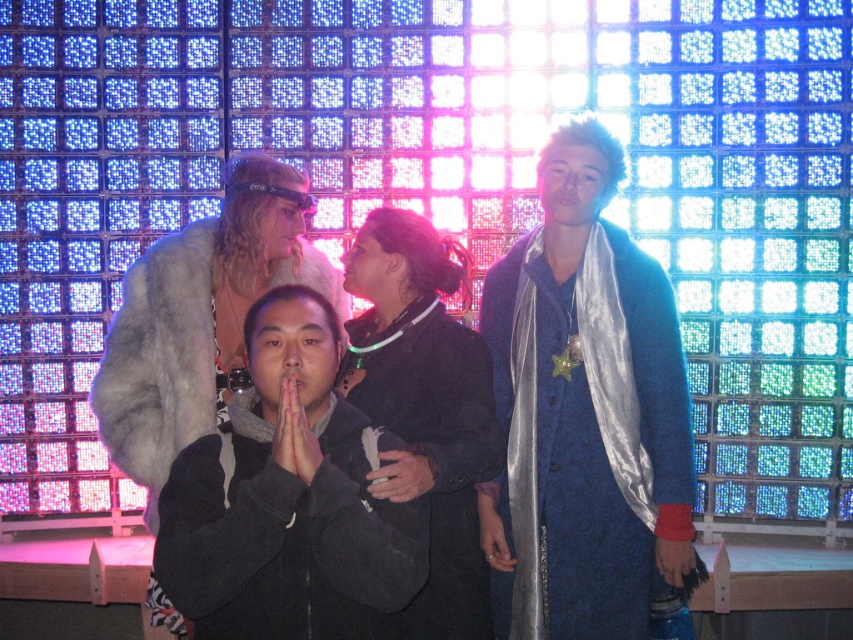
Is black fuzzy coat at center further to camera compared to dark gray fabric hand at center?

No.

Can you confirm if black fuzzy coat at center is positioned to the left of dark gray fabric hand at center?

Correct, you'll find black fuzzy coat at center to the left of dark gray fabric hand at center.

You are a GUI agent. You are given a task and a screenshot of the screen. Output one action in this format:
    pyautogui.click(x=<x>, y=<y>)
    Task: Click on the black fuzzy coat at center
    This screenshot has height=640, width=853.
    Given the screenshot: What is the action you would take?
    pyautogui.click(x=287, y=500)

Image resolution: width=853 pixels, height=640 pixels. I want to click on black fuzzy coat at center, so click(x=287, y=500).

Can you confirm if fuzzy white fur coat at center is wider than matte black hands at center?

Yes.

Looking at this image, can you confirm if fuzzy white fur coat at center is thinner than matte black hands at center?

Incorrect, fuzzy white fur coat at center's width is not less than matte black hands at center's.

Is point (102, 385) positioned before point (302, 440)?

That is False.

Image resolution: width=853 pixels, height=640 pixels. Find the location of `fuzzy white fur coat at center`. fuzzy white fur coat at center is located at coordinates (163, 358).

Is silky blue coat at center bigger than black fuzzy coat at center?

Actually, silky blue coat at center might be smaller than black fuzzy coat at center.

Between silky blue coat at center and black fuzzy coat at center, which one is positioned lower?

silky blue coat at center

Is point (538, 458) more distant than point (189, 522)?

Yes, it is.

Locate an element on the screen. This screenshot has height=640, width=853. silky blue coat at center is located at coordinates (585, 410).